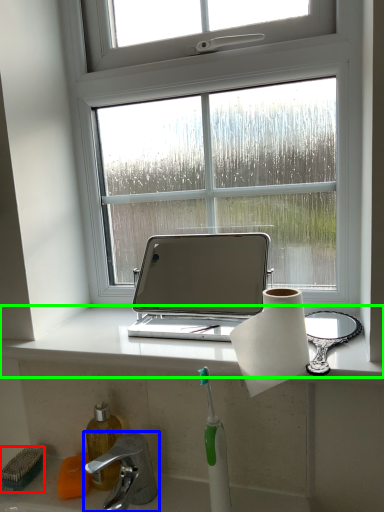
Question: Which is nearer to the brush (highlighted by a red box)? tap (highlighted by a blue box) or window sill (highlighted by a green box).

Choices:
 (A) tap
 (B) window sill

Answer: (A)